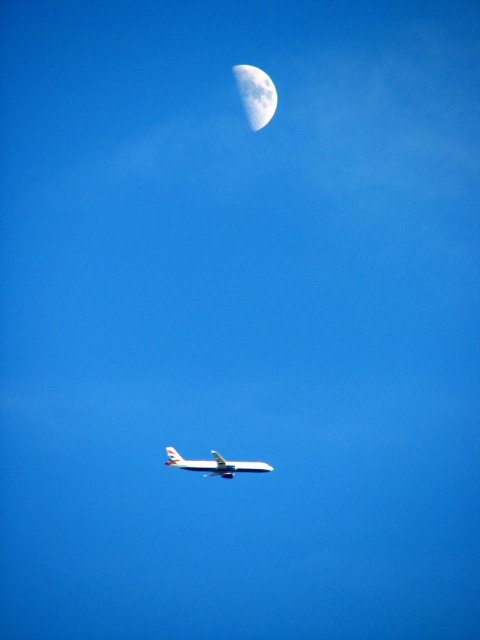
Question: Can you confirm if silver metallic moon at upper center is bigger than white matte airplane at center?

Choices:
 (A) yes
 (B) no

Answer: (B)

Question: In this image, where is silver metallic moon at upper center located relative to white matte airplane at center?

Choices:
 (A) below
 (B) above

Answer: (B)

Question: Which object is closer to the camera taking this photo?

Choices:
 (A) silver metallic moon at upper center
 (B) white matte airplane at center

Answer: (B)

Question: Where is silver metallic moon at upper center located in relation to white matte airplane at center in the image?

Choices:
 (A) left
 (B) right

Answer: (B)